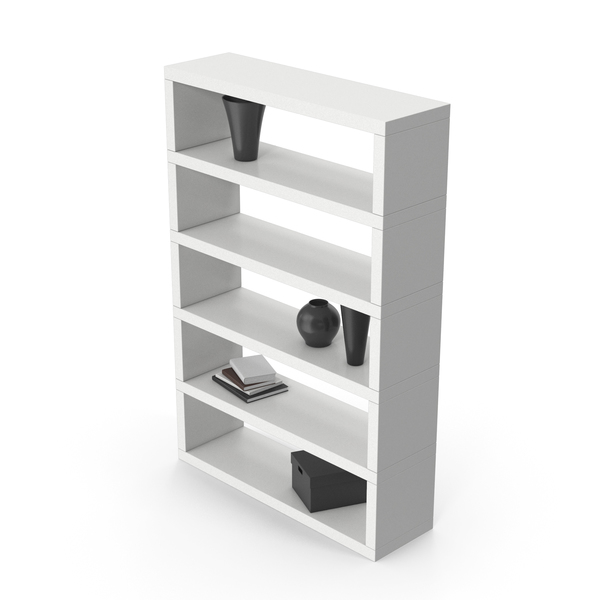
Locate an element on the screen. black cover book is located at coordinates (x=278, y=390).